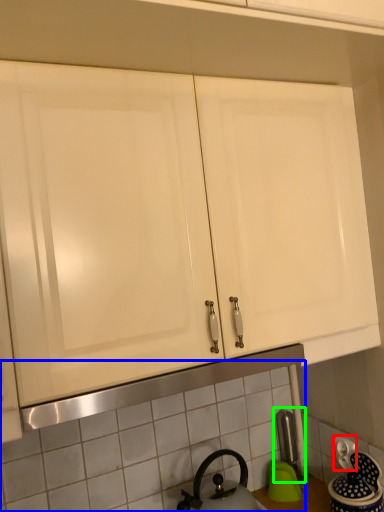
Question: Which object is the closest to the electric outlet (highlighted by a red box)? Choose among these: tile (highlighted by a blue box) or faucet (highlighted by a green box).

Choices:
 (A) tile
 (B) faucet

Answer: (B)